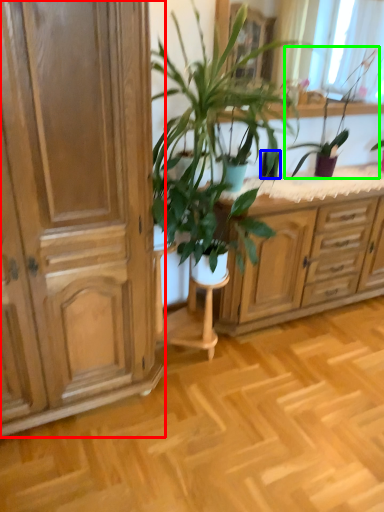
Question: Which object is the closest to the cabinetry (highlighted by a red box)? Choose among these: flowerpot (highlighted by a blue box) or houseplant (highlighted by a green box).

Choices:
 (A) flowerpot
 (B) houseplant

Answer: (A)